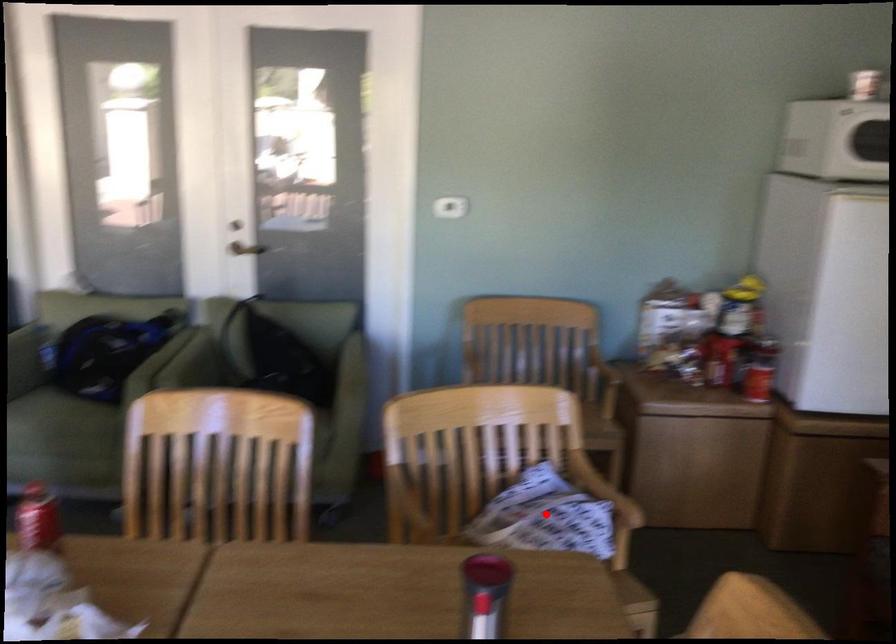
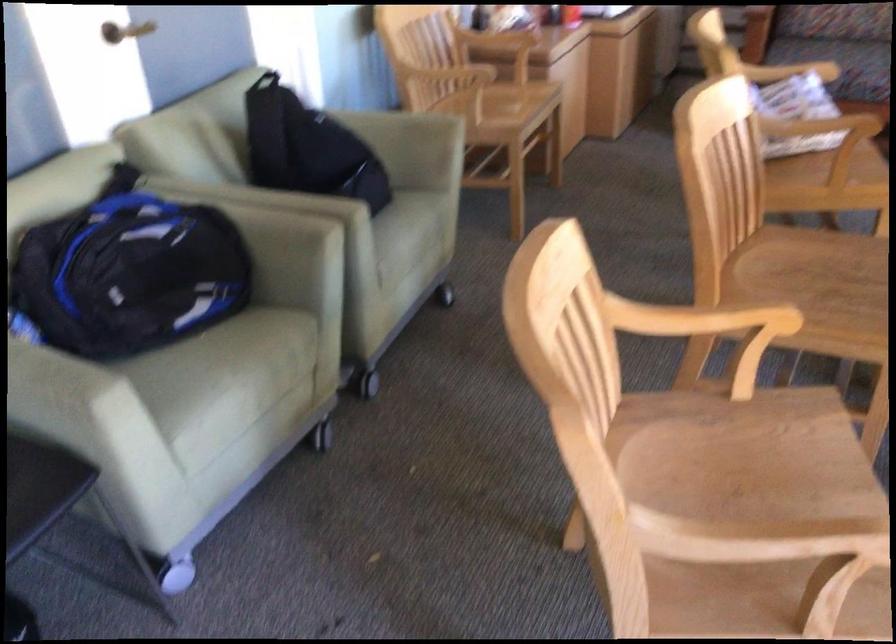
Question: I am providing you with two images of the same scene from different viewpoints. A red point is shown in image1. For the corresponding object point in image2, is it positioned nearer or farther from the camera?

Choices:
 (A) Nearer
 (B) Farther

Answer: (B)